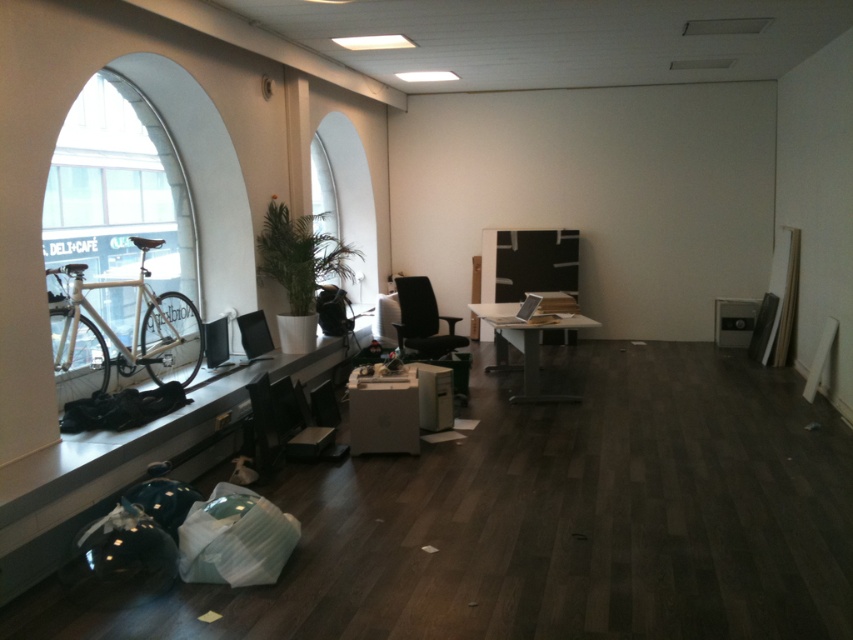
Question: Does transparent glass window at left come behind black plastic chair at lower left?

Choices:
 (A) no
 (B) yes

Answer: (A)

Question: Considering the relative positions of black leather chair at center and black glossy monitor at left in the image provided, where is black leather chair at center located with respect to black glossy monitor at left?

Choices:
 (A) below
 (B) above

Answer: (A)

Question: Does white matte bicycle at left have a greater width compared to black plastic chair at center?

Choices:
 (A) no
 (B) yes

Answer: (B)

Question: Which point appears closest to the camera in this image?

Choices:
 (A) (178, 344)
 (B) (241, 321)
 (C) (495, 317)

Answer: (A)

Question: Which object is the closest to the white matte bicycle at left?

Choices:
 (A) transparent glass window at left
 (B) black plastic chair at center
 (C) white glossy table at center

Answer: (A)

Question: Which of these objects is positioned closest to the white matte bicycle at left?

Choices:
 (A) black plastic chair at center
 (B) black glossy monitor at left
 (C) transparent glass window at left

Answer: (C)